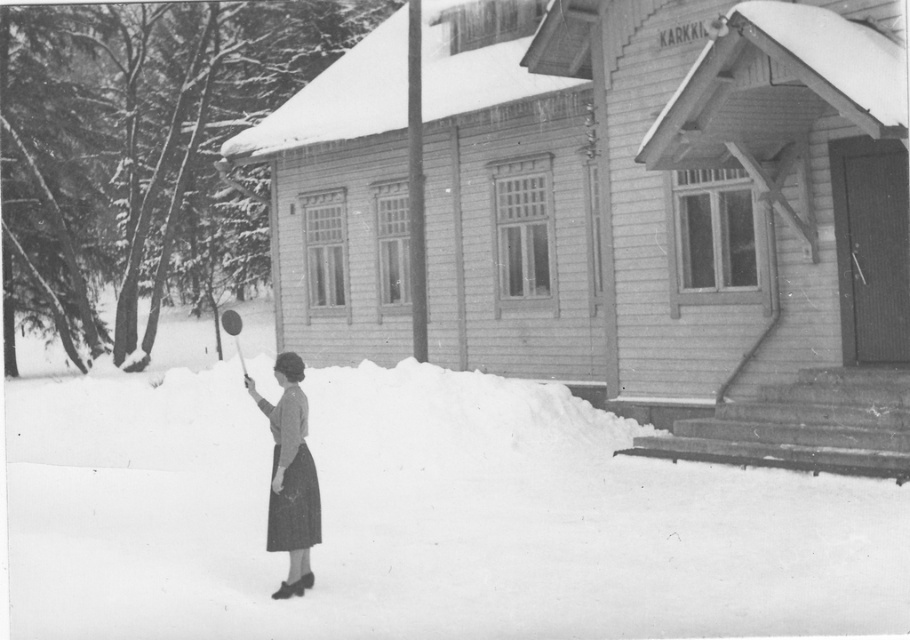
You are standing in front of the wooden building labeled KARKKI and want to take a photo of the two points marked in the image. Which point, point (x=201, y=467) or point (x=271, y=433), will appear closer to the camera in your photo?

Point (x=201, y=467) will appear closer to the camera in the photo because it is further to the camera than point (x=271, y=433) according to the description.

You are a photographer planning to take a picture of the wooden building labeled KARKKI. You want to ensure the white fluffy snow at lower left and the smooth gray dress at lower left are both visible in the frame. Based on their sizes, which object will occupy more space in the photo?

The white fluffy snow at lower left is larger in size than the smooth gray dress at lower left, so it will occupy more space in the photo.

You are standing at the entrance of the wooden building labeled KARKKI. Looking down, you notice a specific point marked at coordinates (420, 518). What is located at that point?

The point at (420, 518) marks white fluffy snow at lower left.